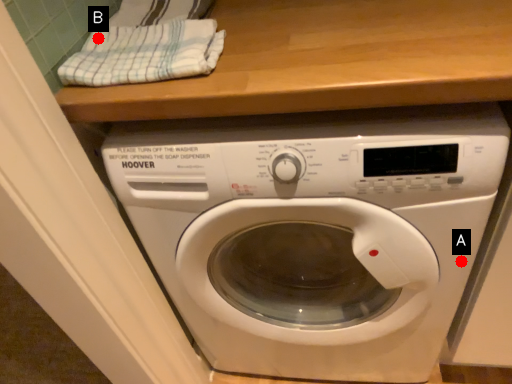
Question: Two points are circled on the image, labeled by A and B beside each circle. Which point appears closest to the camera in this image?

Choices:
 (A) A is closer
 (B) B is closer

Answer: (B)